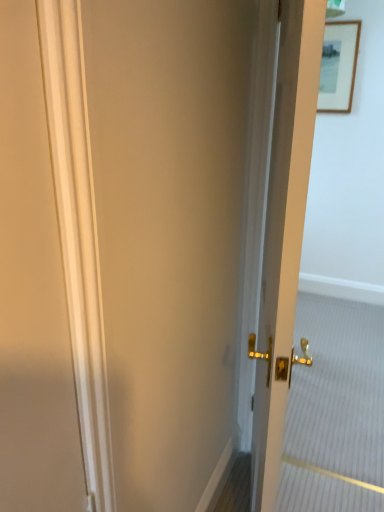
Question: From a real-world perspective, is wooden framed picture at upper right positioned under matte gold door at center based on gravity?

Choices:
 (A) no
 (B) yes

Answer: (A)

Question: Is wooden framed picture at upper right taller than matte gold door at center?

Choices:
 (A) yes
 (B) no

Answer: (B)

Question: Would you consider wooden framed picture at upper right to be distant from matte gold door at center?

Choices:
 (A) yes
 (B) no

Answer: (A)

Question: Is wooden framed picture at upper right outside matte gold door at center?

Choices:
 (A) no
 (B) yes

Answer: (B)

Question: Could you tell me if wooden framed picture at upper right is facing matte gold door at center?

Choices:
 (A) no
 (B) yes

Answer: (B)

Question: Is wooden framed picture at upper right wider than matte gold door at center?

Choices:
 (A) no
 (B) yes

Answer: (A)

Question: Could you tell me if matte gold door at center is facing wooden framed picture at upper right?

Choices:
 (A) no
 (B) yes

Answer: (A)

Question: Does matte gold door at center have a smaller size compared to wooden framed picture at upper right?

Choices:
 (A) yes
 (B) no

Answer: (B)

Question: Is matte gold door at center at the left side of wooden framed picture at upper right?

Choices:
 (A) no
 (B) yes

Answer: (B)

Question: Is matte gold door at center closer to the viewer compared to wooden framed picture at upper right?

Choices:
 (A) yes
 (B) no

Answer: (A)

Question: Can you confirm if matte gold door at center is shorter than wooden framed picture at upper right?

Choices:
 (A) yes
 (B) no

Answer: (B)

Question: From a real-world perspective, is matte gold door at center beneath wooden framed picture at upper right?

Choices:
 (A) no
 (B) yes

Answer: (B)

Question: Looking at their shapes, would you say wooden framed picture at upper right is wider or thinner than matte gold door at center?

Choices:
 (A) wide
 (B) thin

Answer: (B)